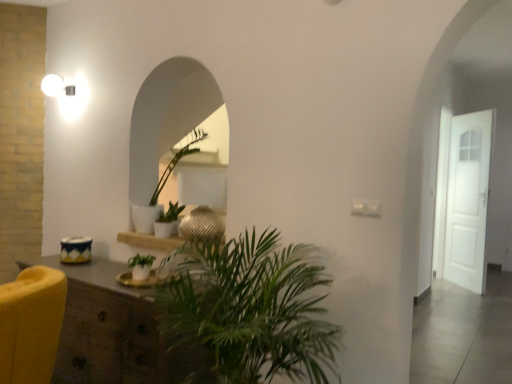
Question: Is green matte plant at center, which is counted as the 1th houseplant, starting from the top, taller or shorter than wooden shelf at center?

Choices:
 (A) tall
 (B) short

Answer: (A)

Question: In terms of size, does green matte plant at center, the 3th houseplant from the front, appear bigger or smaller than wooden shelf at center?

Choices:
 (A) big
 (B) small

Answer: (A)

Question: Which object is the farthest from the white matte door at right?

Choices:
 (A) wooden cabinet at lower left
 (B) wooden shelf at center
 (C) green matte plant at center, the 3th houseplant from the front
 (D) green matte plant at center, which ranks as the 2th houseplant in front-to-back order
 (E) green leafy plant at center, the 3th houseplant when ordered from back to front

Answer: (A)

Question: Estimate the real-world distances between objects in this image. Which object is farther from the wooden shelf at center?

Choices:
 (A) green leafy plant at center, the 3th houseplant in the top-to-bottom sequence
 (B) green matte plant at center, the 3th houseplant from the front
 (C) white matte door at right
 (D) green matte plant at center, which ranks as the 2th houseplant in front-to-back order
 (E) wooden cabinet at lower left

Answer: (C)